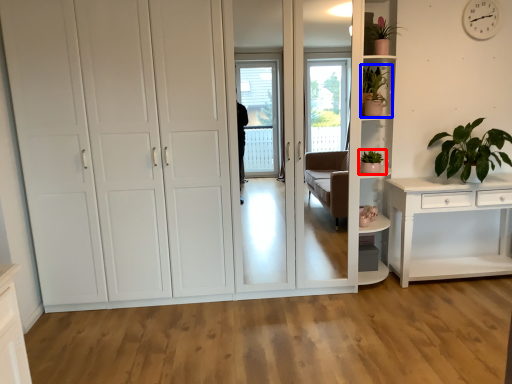
Question: Which point is closer to the camera, houseplant (highlighted by a red box) or houseplant (highlighted by a blue box)?

Choices:
 (A) houseplant
 (B) houseplant

Answer: (B)